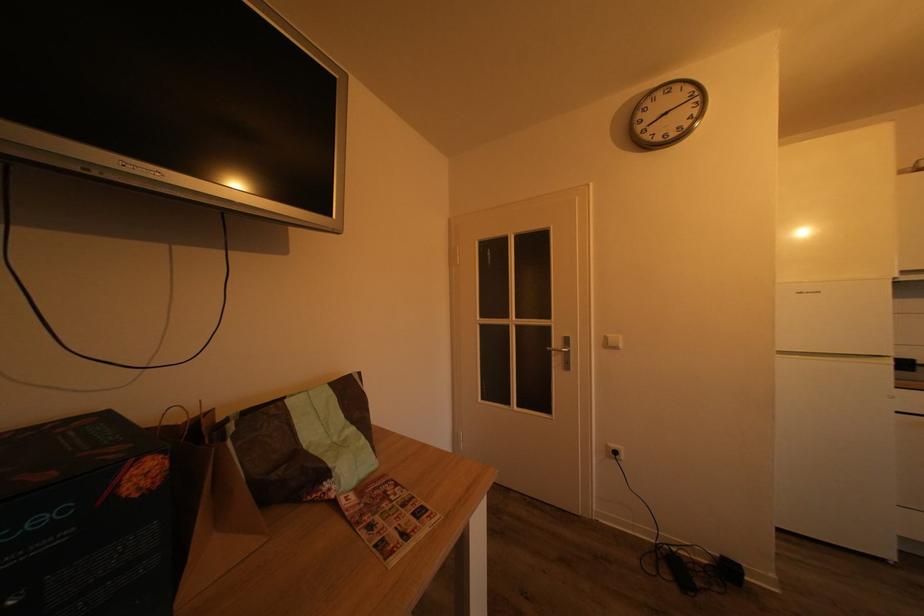
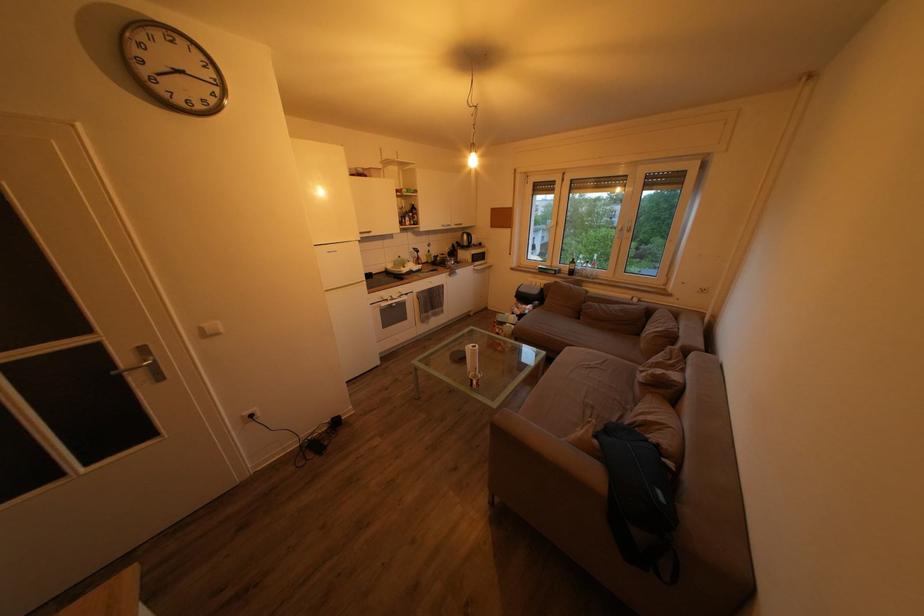
The point at (616, 342) is marked in the first image. Where is the corresponding point in the second image?

(211, 331)